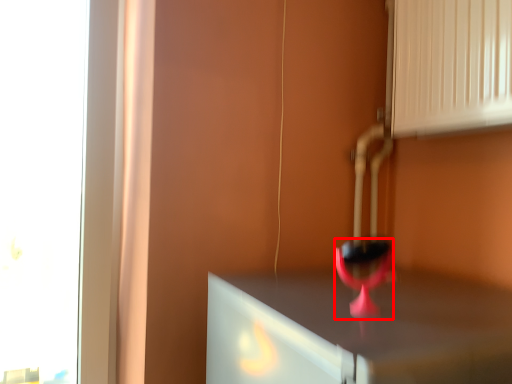
Question: Where is wine glass (annotated by the red box) located in relation to vent in the image?

Choices:
 (A) left
 (B) right

Answer: (A)